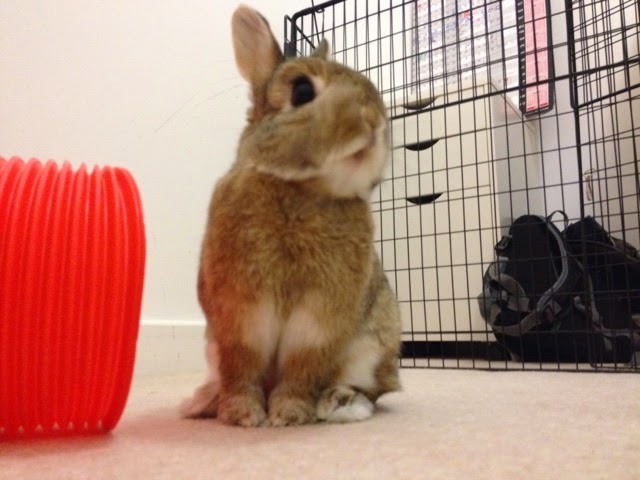
This screenshot has width=640, height=480. Identify the location of wall. (138, 94).